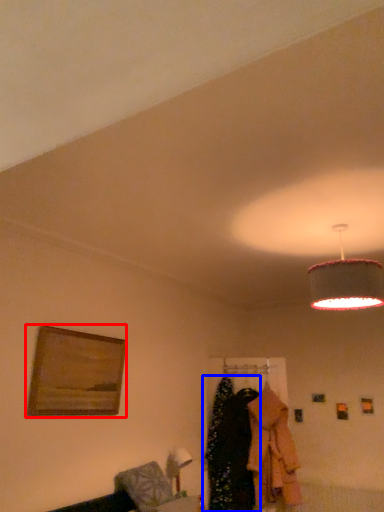
Question: Which object appears closest to the camera in this image, picture frame (highlighted by a red box) or clothing (highlighted by a blue box)?

Choices:
 (A) picture frame
 (B) clothing

Answer: (A)